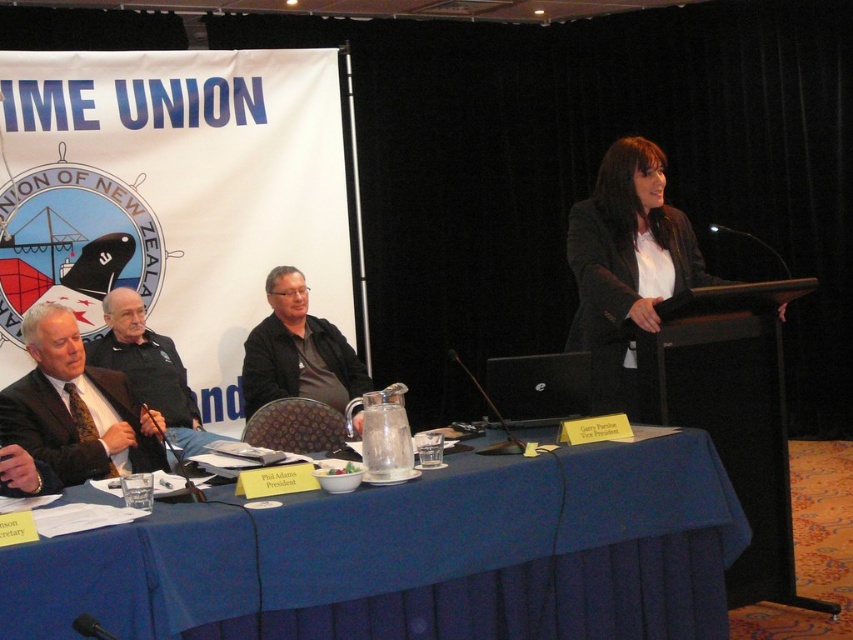
Who is taller, blue fabric table at center or black leather jacket at center?

With more height is black leather jacket at center.

Is blue fabric table at center to the left of black leather jacket at center from the viewer's perspective?

Incorrect, blue fabric table at center is not on the left side of black leather jacket at center.

The image size is (853, 640). Identify the location of blue fabric table at center. (x=512, y=548).

At what (x,y) coordinates should I click in order to perform the action: click on blue fabric table at center. Please return your answer as a coordinate pair (x, y). This screenshot has width=853, height=640. Looking at the image, I should click on (512, 548).

Which is above, black leather jacket at center or dark suit at left?

black leather jacket at center is higher up.

This screenshot has width=853, height=640. What do you see at coordinates (297, 352) in the screenshot?
I see `black leather jacket at center` at bounding box center [297, 352].

Measure the distance between point [341,356] and camera.

4.38 meters

This screenshot has width=853, height=640. Find the location of `black leather jacket at center`. black leather jacket at center is located at coordinates (297, 352).

Is matte black suit at left taller than dark suit at left?

No.

Which is more to the left, matte black suit at left or dark suit at left?

dark suit at left

Locate an element on the screen. matte black suit at left is located at coordinates (49, 429).

Find the location of `matte black suit at left`. matte black suit at left is located at coordinates (49, 429).